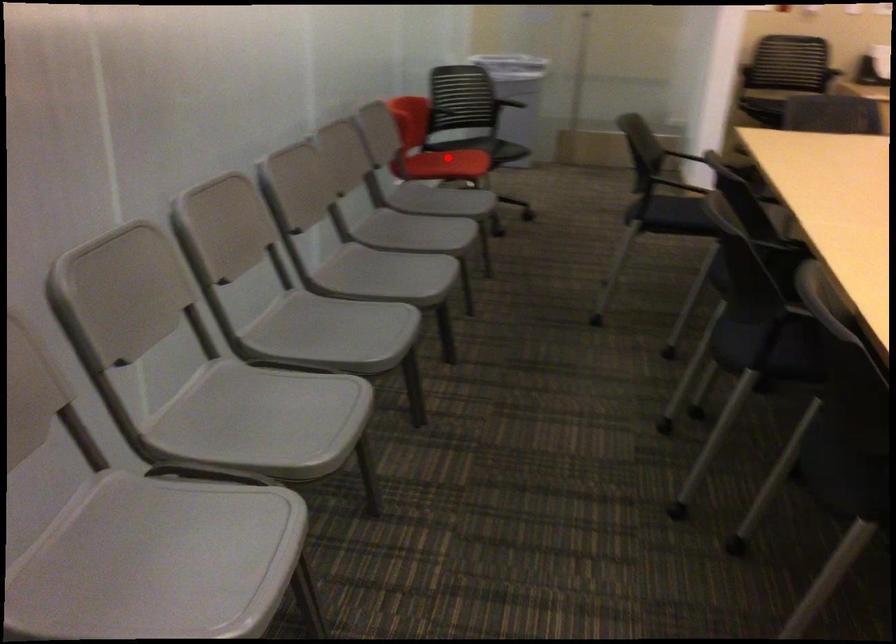
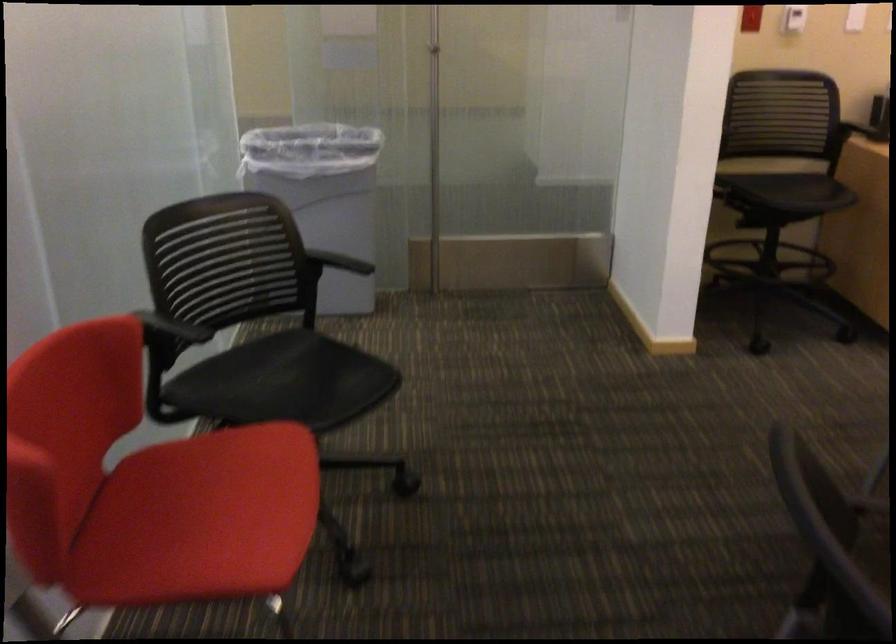
Question: I am providing you with two images of the same scene from different viewpoints. In image1, a red point is highlighted. Considering the same 3D point in image2, which of the following is correct?

Choices:
 (A) It is closer
 (B) It is farther

Answer: (A)